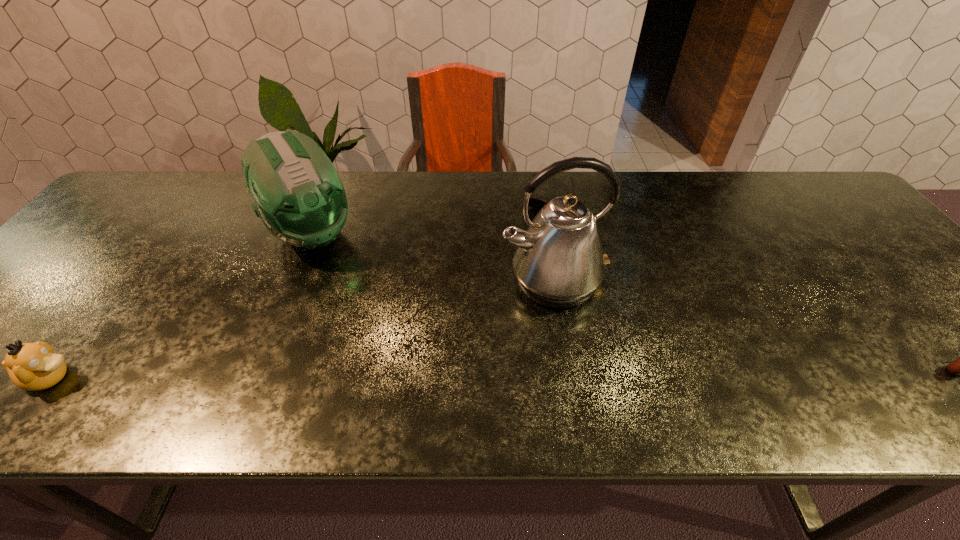
I want to click on vacant space situated on the visor of the second tallest object, so tap(370, 320).

In order to click on vacant space located 0.310m on the visor of the second tallest object in this screenshot , I will do `click(387, 344)`.

Where is `vacant space situated 0.300m on the visor of the second tallest object`? The width and height of the screenshot is (960, 540). vacant space situated 0.300m on the visor of the second tallest object is located at coordinates (385, 341).

The width and height of the screenshot is (960, 540). Identify the location of vacant point located from the spout of the tallest object. (597, 376).

Where is `free spot located 0.150m from the spout of the tallest object`? Image resolution: width=960 pixels, height=540 pixels. free spot located 0.150m from the spout of the tallest object is located at coordinates (595, 372).

Where is `vacant space located 0.090m from the spout of the tallest object`? vacant space located 0.090m from the spout of the tallest object is located at coordinates (585, 347).

Find the location of a particular element. The width and height of the screenshot is (960, 540). sunglasses situated at the far edge is located at coordinates (537, 203).

At what (x,y) coordinates should I click in order to perform the action: click on football helmet located in the far edge section of the desktop. Please return your answer as a coordinate pair (x, y). The width and height of the screenshot is (960, 540). Looking at the image, I should click on (298, 194).

Where is `object located at the near edge`? object located at the near edge is located at coordinates (31, 366).

The height and width of the screenshot is (540, 960). Identify the location of object that is at the left edge. (31, 366).